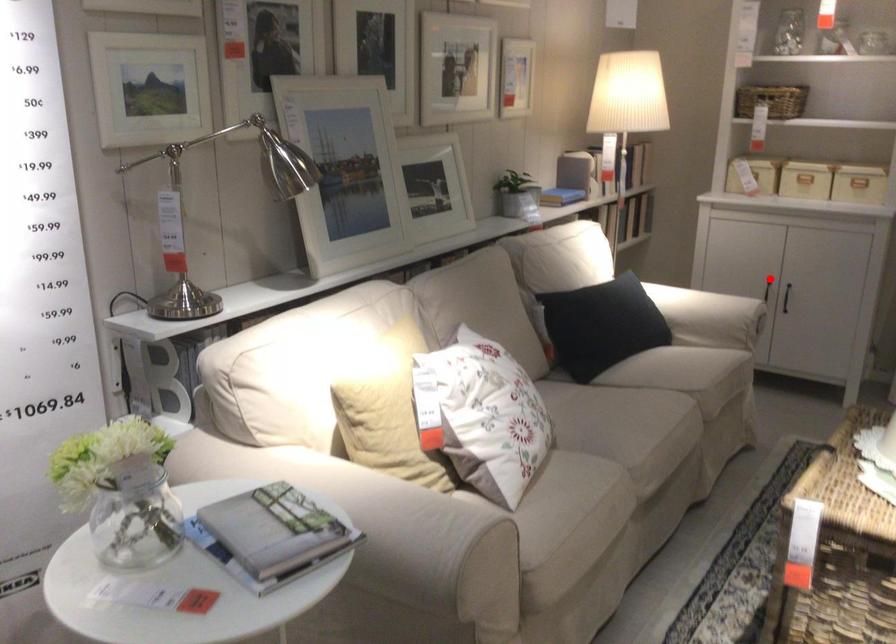
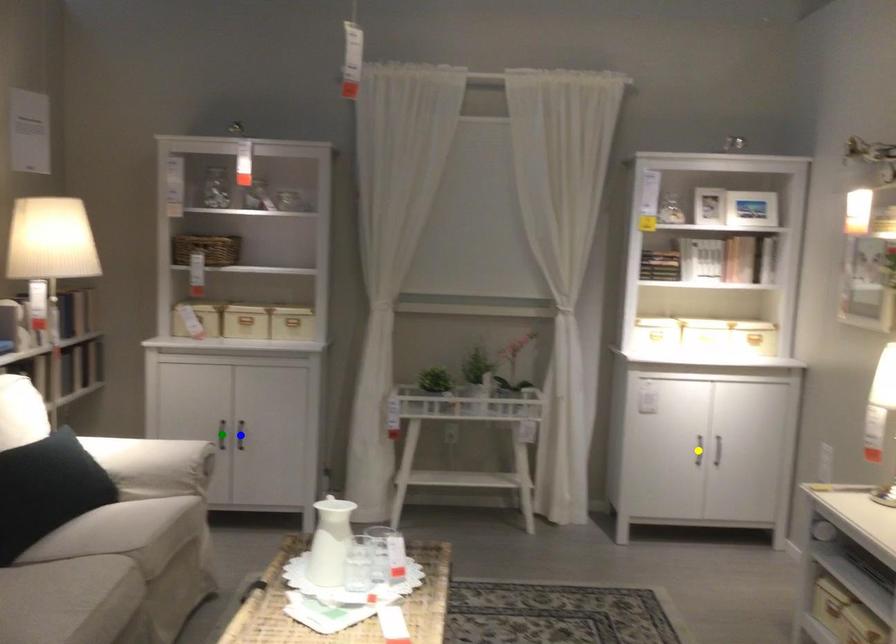
Question: I am providing you with two images of the same scene from different viewpoints. A red point is marked on the first image. You are given multiple points on the second image. Which point in image 2 is actually the same real-world point as the red point in image 1?

Choices:
 (A) green point
 (B) yellow point
 (C) blue point

Answer: (A)